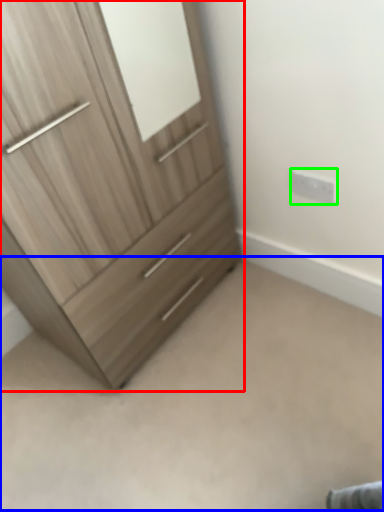
Question: Based on their relative distances, which object is nearer to chest of drawers (highlighted by a red box)? Choose from plain (highlighted by a blue box) and electric outlet (highlighted by a green box).

Choices:
 (A) plain
 (B) electric outlet

Answer: (A)